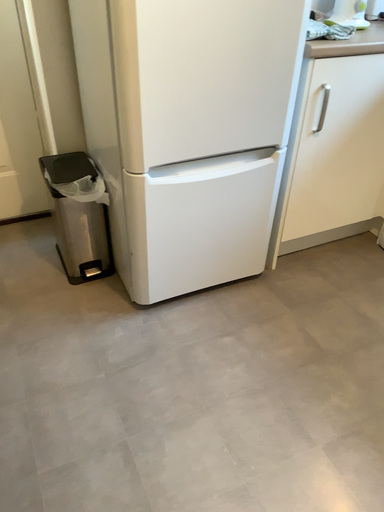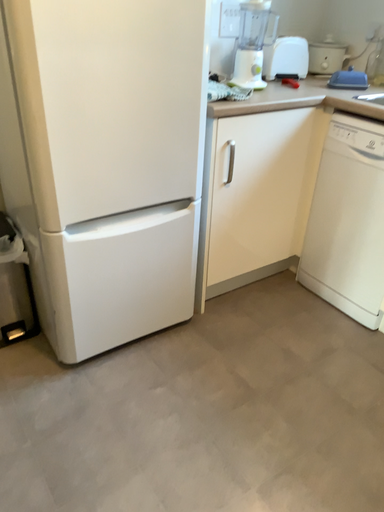
Question: How did the camera likely rotate when shooting the video?

Choices:
 (A) rotated upward
 (B) rotated downward

Answer: (A)